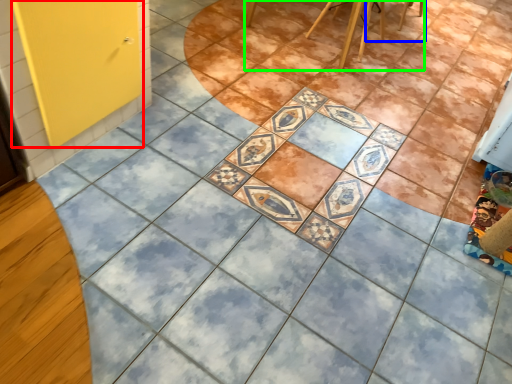
Question: Considering the real-world distances, which object is closest to screen door (highlighted by a red box)? chair (highlighted by a blue box) or furniture (highlighted by a green box).

Choices:
 (A) chair
 (B) furniture

Answer: (B)